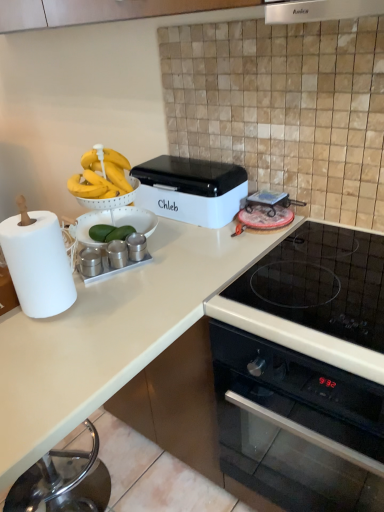
Question: Could you tell me if white plastic bread bin at center is facing satin silver exhaust hood at upper center?

Choices:
 (A) no
 (B) yes

Answer: (A)

Question: Can you confirm if white plastic bread bin at center is positioned to the left of satin silver exhaust hood at upper center?

Choices:
 (A) yes
 (B) no

Answer: (A)

Question: Does white plastic bread bin at center touch satin silver exhaust hood at upper center?

Choices:
 (A) no
 (B) yes

Answer: (A)

Question: Is white plastic bread bin at center in front of satin silver exhaust hood at upper center?

Choices:
 (A) no
 (B) yes

Answer: (A)

Question: Considering the relative sizes of white plastic bread bin at center and satin silver exhaust hood at upper center in the image provided, is white plastic bread bin at center taller than satin silver exhaust hood at upper center?

Choices:
 (A) no
 (B) yes

Answer: (B)

Question: In terms of height, does satin silver exhaust hood at upper center look taller or shorter compared to black glass oven at lower right?

Choices:
 (A) short
 (B) tall

Answer: (A)

Question: Considering the relative positions of satin silver exhaust hood at upper center and black glass oven at lower right in the image provided, is satin silver exhaust hood at upper center to the left or to the right of black glass oven at lower right?

Choices:
 (A) left
 (B) right

Answer: (A)

Question: Considering the positions of satin silver exhaust hood at upper center and black glass oven at lower right in the image, is satin silver exhaust hood at upper center wider or thinner than black glass oven at lower right?

Choices:
 (A) thin
 (B) wide

Answer: (A)

Question: Choose the correct answer: Is satin silver exhaust hood at upper center inside black glass oven at lower right or outside it?

Choices:
 (A) inside
 (B) outside

Answer: (B)

Question: From the image's perspective, is white plastic bread bin at center positioned above or below white matte countertop at lower left?

Choices:
 (A) below
 (B) above

Answer: (B)

Question: In terms of size, does white plastic bread bin at center appear bigger or smaller than white matte countertop at lower left?

Choices:
 (A) small
 (B) big

Answer: (A)

Question: Does point (226, 177) appear closer or farther from the camera than point (180, 307)?

Choices:
 (A) closer
 (B) farther

Answer: (B)

Question: Considering the positions of white plastic bread bin at center and white matte countertop at lower left in the image, is white plastic bread bin at center taller or shorter than white matte countertop at lower left?

Choices:
 (A) tall
 (B) short

Answer: (B)

Question: In terms of width, does black glass oven at lower right look wider or thinner when compared to white paper at left?

Choices:
 (A) wide
 (B) thin

Answer: (A)

Question: Relative to white paper at left, is black glass oven at lower right in front or behind?

Choices:
 (A) behind
 (B) front

Answer: (B)